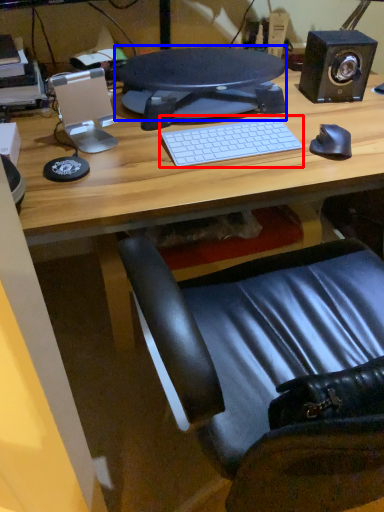
Question: Which point is further to the camera, computer keyboard (highlighted by a red box) or computer monitor (highlighted by a blue box)?

Choices:
 (A) computer keyboard
 (B) computer monitor

Answer: (B)